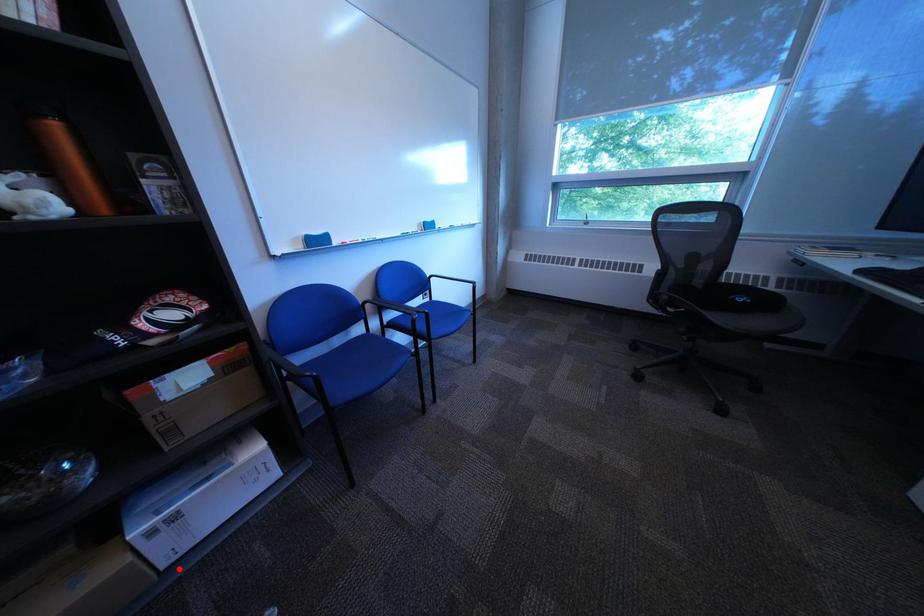
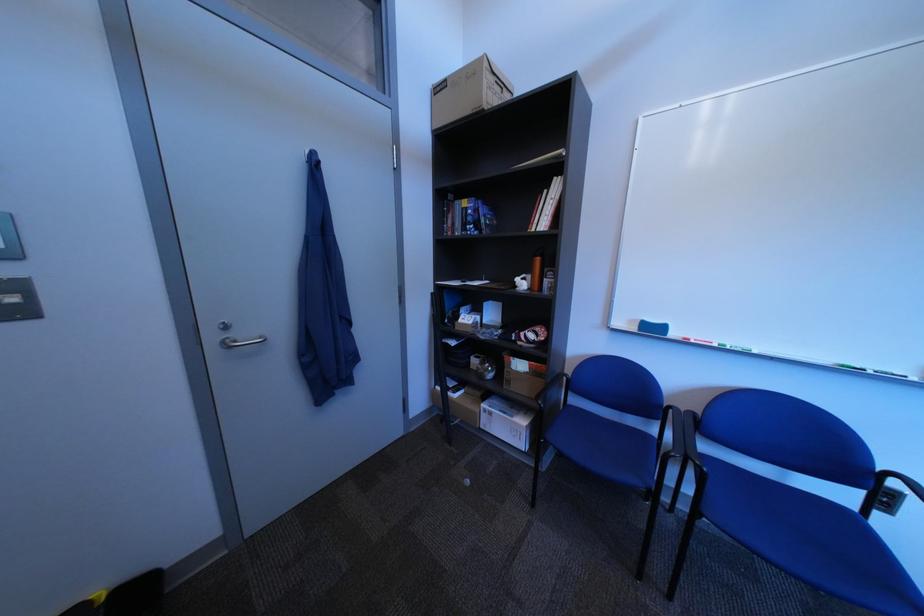
In the second image, find the point that corresponds to the highlighted location in the first image.

(496, 429)